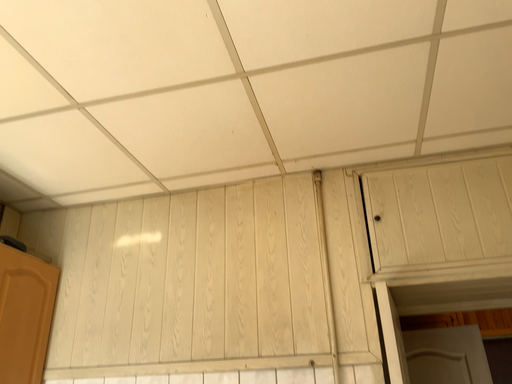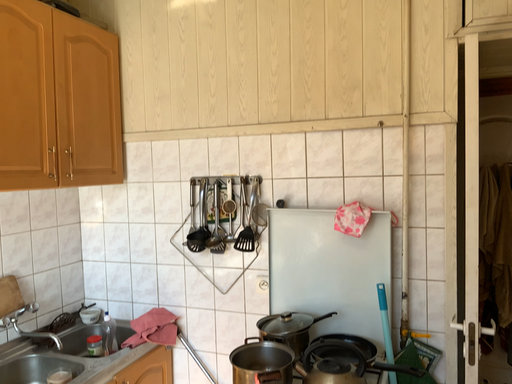
Question: How did the camera likely rotate when shooting the video?

Choices:
 (A) rotated left
 (B) rotated right

Answer: (A)